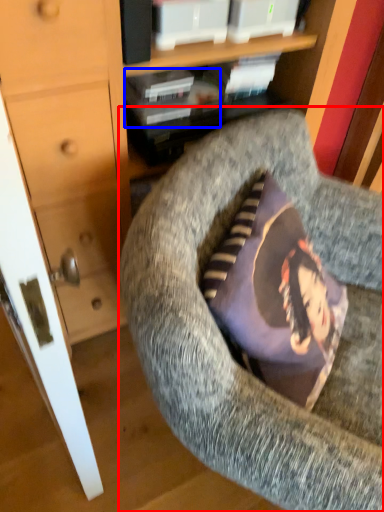
Question: Which object is further to the camera taking this photo, chair (highlighted by a red box) or book (highlighted by a blue box)?

Choices:
 (A) chair
 (B) book

Answer: (B)